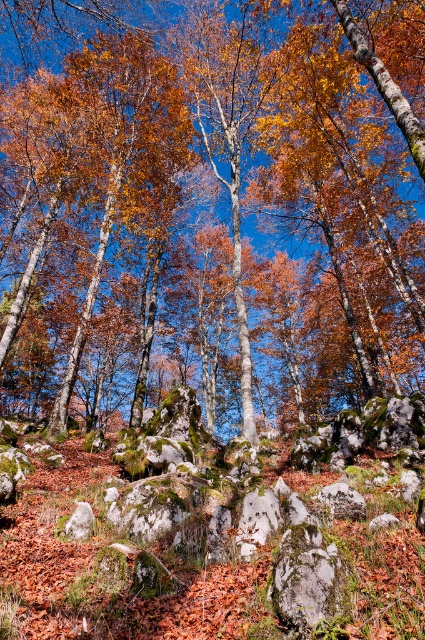
You are a hiker trying to navigate through the autumnal forest. You need to step over an obstacle between the smooth stone boulder at center and the mossy stone hillside at center. Which direction should you move to avoid the obstacle?

You should move to the right of the mossy stone hillside at center because the smooth stone boulder at center is located to its right, so stepping towards that direction would avoid the obstacle between them.

You are standing at the center of the image and want to place a small flag exactly at the location of the smooth stone boulder at center. What are the coordinates where you should place the flag?

The coordinates for the smooth stone boulder at center are at point (209, 208), so you should place the flag there.

You are a hiker who wants to place a small tent on the smooth stone boulder at center or the mossy stone hillside at center. Which location would provide a more stable base for the tent?

The smooth stone boulder at center is positioned over mossy stone hillside at center, so the smooth stone boulder at center would provide a more stable base for the tent since it is a solid surface above the hillside.